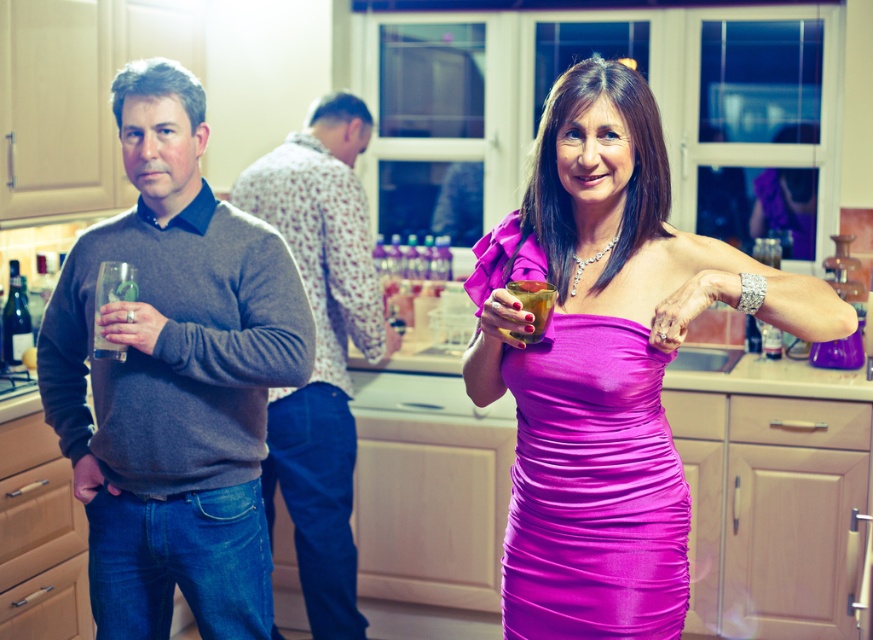
Question: Which object is closer to the camera taking this photo?

Choices:
 (A) translucent glass drink at center
 (B) gray sweater at left

Answer: (A)

Question: Which of the following is the closest to the observer?

Choices:
 (A) (12, 276)
 (B) (301, 404)

Answer: (B)

Question: Is gray sweater at left smaller than satin pink dress at center?

Choices:
 (A) no
 (B) yes

Answer: (A)

Question: Is flannel shirt at center wider than dark red glass bottle at left?

Choices:
 (A) no
 (B) yes

Answer: (B)

Question: In this image, where is gray sweater at left located relative to dark red glass bottle at left?

Choices:
 (A) right
 (B) left

Answer: (A)

Question: Considering the real-world distances, which object is closest to the dark red glass bottle at left?

Choices:
 (A) flannel shirt at center
 (B) clear glass at left
 (C) satin pink dress at center
 (D) translucent glass drink at center

Answer: (A)